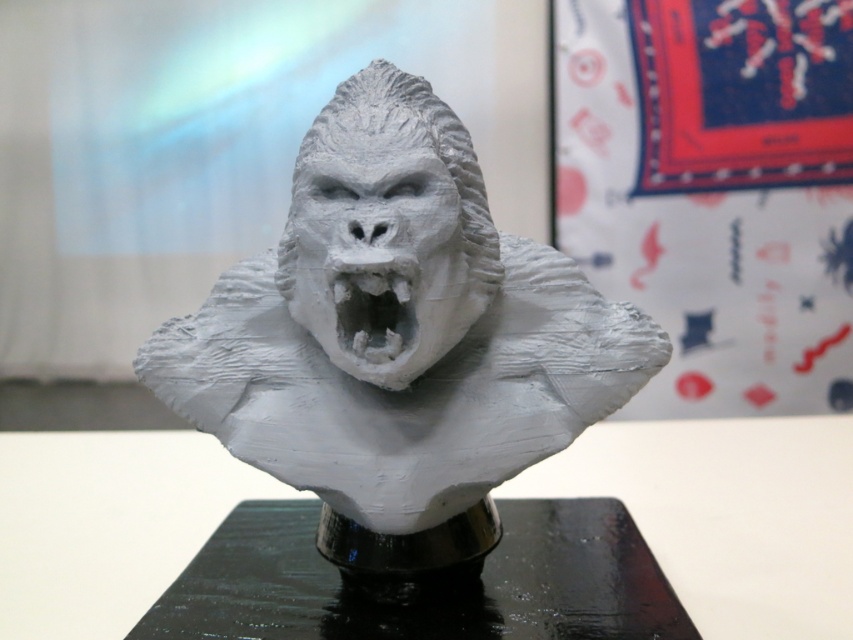
Who is lower down, white matte gorilla bust at center or black glossy table at center?

black glossy table at center is below.

Is point (480, 500) positioned after point (268, 625)?

Yes, point (480, 500) is farther from viewer.

Does point (264, 276) lie in front of point (172, 628)?

No.

You are a GUI agent. You are given a task and a screenshot of the screen. Output one action in this format:
    pyautogui.click(x=<x>, y=<y>)
    Task: Click on the white matte gorilla bust at center
    This screenshot has height=640, width=853.
    Given the screenshot: What is the action you would take?
    point(405,349)

Does black glossy table at center have a greater width compared to white matte plastic mouth at center?

Yes.

Between black glossy table at center and white matte plastic mouth at center, which one appears on the right side from the viewer's perspective?

From the viewer's perspective, black glossy table at center appears more on the right side.

In the scene shown: Who is more forward, [177,634] or [386,291]?

Positioned in front is point [386,291].

You are a GUI agent. You are given a task and a screenshot of the screen. Output one action in this format:
    pyautogui.click(x=<x>, y=<y>)
    Task: Click on the black glossy table at center
    
    Given the screenshot: What is the action you would take?
    pyautogui.click(x=424, y=582)

Can you confirm if white matte gorilla bust at center is taller than white matte plastic mouth at center?

Yes, white matte gorilla bust at center is taller than white matte plastic mouth at center.

Between point (308, 282) and point (369, 323), which one is positioned in front?

Positioned in front is point (369, 323).

Which is behind, point (485, 428) or point (389, 288)?

The point (485, 428) is more distant.

You are a GUI agent. You are given a task and a screenshot of the screen. Output one action in this format:
    pyautogui.click(x=<x>, y=<y>)
    Task: Click on the white matte gorilla bust at center
    
    Given the screenshot: What is the action you would take?
    pyautogui.click(x=405, y=349)